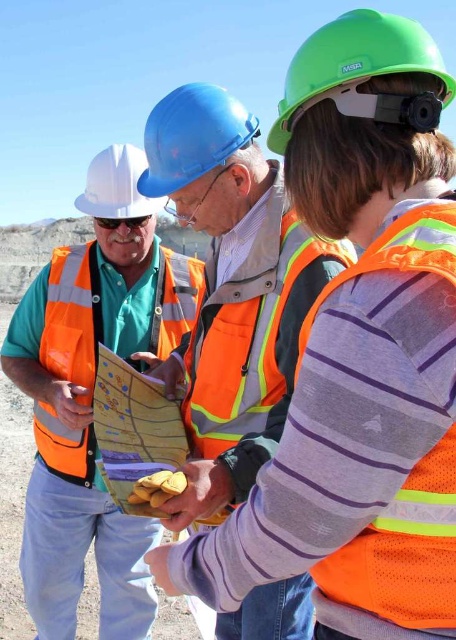
You are a safety inspector assessing the equipment of workers at the construction site. You notice the orange mesh safety vest at center and the matte blue goggles at center. Which piece of equipment is wider?

The orange mesh safety vest at center is wider than the matte blue goggles at center.

You are standing at the construction site and need to determine which of the two points, point (265,278) or point (150,216), is nearer to you. Based on the scene description, which point is closer?

Point (265,278) is closer to the viewer than point (150,216).

You are a safety inspector who needs to check if the distance between the orange mesh safety vest at center and the matte blue goggles at center is within the required 20 meters for proper visibility. Based on the scene, can you confirm if this distance meets the requirement?

The distance between the orange mesh safety vest at center and the matte blue goggles at center is 18.18 meters, which is within the required 20 meters for proper visibility.